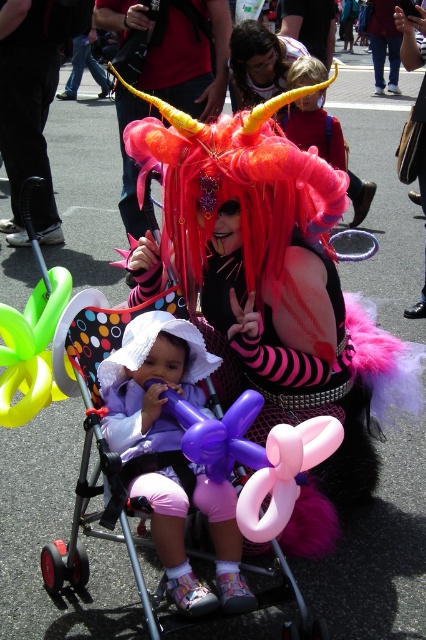
Question: Considering the relative positions of polka dot fabric baby carriage at center and pink rubber balloon at center in the image provided, where is polka dot fabric baby carriage at center located with respect to pink rubber balloon at center?

Choices:
 (A) right
 (B) left

Answer: (B)

Question: Which point appears farthest from the camera in this image?

Choices:
 (A) (301, 461)
 (B) (310, 115)
 (C) (227, 499)
 (D) (69, 355)

Answer: (B)

Question: Is polka dot fabric baby carriage at center to the left of fluffy pink wig at center from the viewer's perspective?

Choices:
 (A) yes
 (B) no

Answer: (A)

Question: Estimate the real-world distances between objects in this image. Which object is farther from the polka dot fabric baby carriage at center?

Choices:
 (A) purple fabric balloon at center
 (B) fluffy pink wig at center
 (C) pink rubber balloon at center

Answer: (B)

Question: Does polka dot fabric baby carriage at center appear on the right side of pink rubber balloon at center?

Choices:
 (A) yes
 (B) no

Answer: (B)

Question: Which of these objects is positioned closest to the polka dot fabric baby carriage at center?

Choices:
 (A) fluffy pink wig at center
 (B) shiny pink wig at center

Answer: (B)